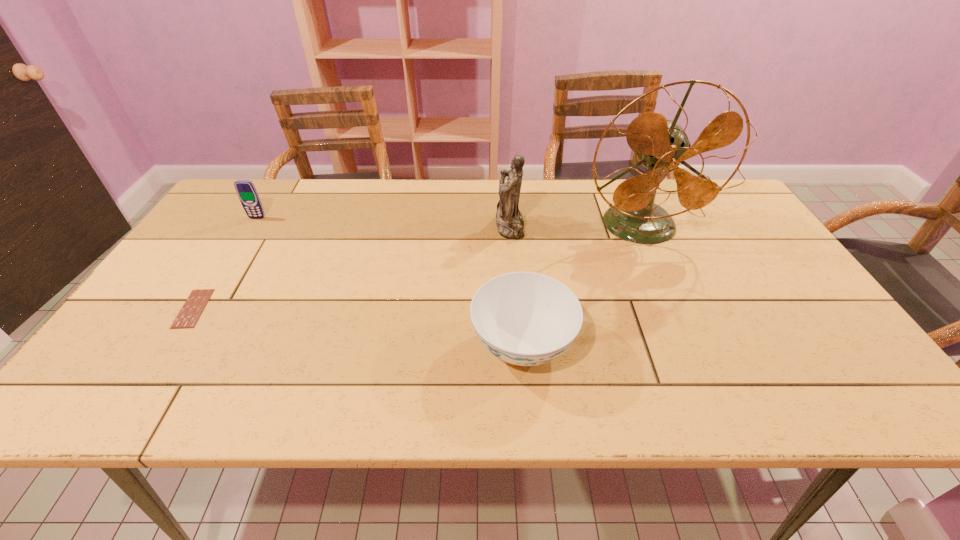
The width and height of the screenshot is (960, 540). I want to click on vacant space that is in between the chocolate bar and the cellular telephone, so click(226, 263).

Where is `free space between the chocolate bar and the figurine`? The height and width of the screenshot is (540, 960). free space between the chocolate bar and the figurine is located at coordinates (351, 267).

Identify the location of free space between the fan and the figurine. Image resolution: width=960 pixels, height=540 pixels. pyautogui.click(x=575, y=226).

This screenshot has width=960, height=540. Find the location of `free space between the chinaware and the rightmost object`. free space between the chinaware and the rightmost object is located at coordinates (582, 286).

This screenshot has width=960, height=540. I want to click on vacant area between the rightmost object and the chinaware, so click(x=582, y=286).

The image size is (960, 540). Identify the location of object that is the closest to the figurine. (661, 145).

This screenshot has width=960, height=540. I want to click on object that ranks as the fourth closest to the shortest object, so click(x=661, y=145).

Find the location of `blank area in the image that satisfies the following two spatial constraints: 1. on the front-facing side of the chinaware; 2. on the left side of the figurine`. blank area in the image that satisfies the following two spatial constraints: 1. on the front-facing side of the chinaware; 2. on the left side of the figurine is located at coordinates (519, 346).

You are a GUI agent. You are given a task and a screenshot of the screen. Output one action in this format:
    pyautogui.click(x=<x>, y=<y>)
    Task: Click on the vacant area that satisfies the following two spatial constraints: 1. on the front-facing side of the chinaware; 2. on the right side of the cellular telephone
    Image resolution: width=960 pixels, height=540 pixels.
    Given the screenshot: What is the action you would take?
    pyautogui.click(x=177, y=346)